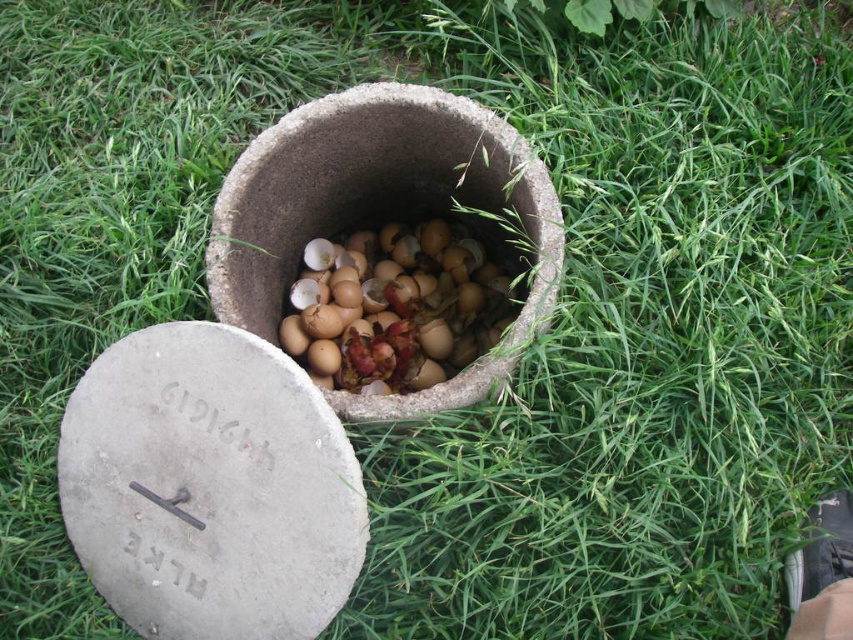
Question: Can you confirm if gray concrete lid at center is thinner than brown matte eggshells at center?

Choices:
 (A) no
 (B) yes

Answer: (A)

Question: Does gray concrete lid at center have a greater width compared to brown matte eggshells at center?

Choices:
 (A) yes
 (B) no

Answer: (A)

Question: Is gray concrete lid at center above brown matte eggshells at center?

Choices:
 (A) no
 (B) yes

Answer: (A)

Question: Which object is closer to the camera taking this photo?

Choices:
 (A) gray concrete lid at center
 (B) brown matte eggshells at center

Answer: (A)

Question: Among these points, which one is farthest from the camera?

Choices:
 (A) (90, 532)
 (B) (503, 288)

Answer: (B)